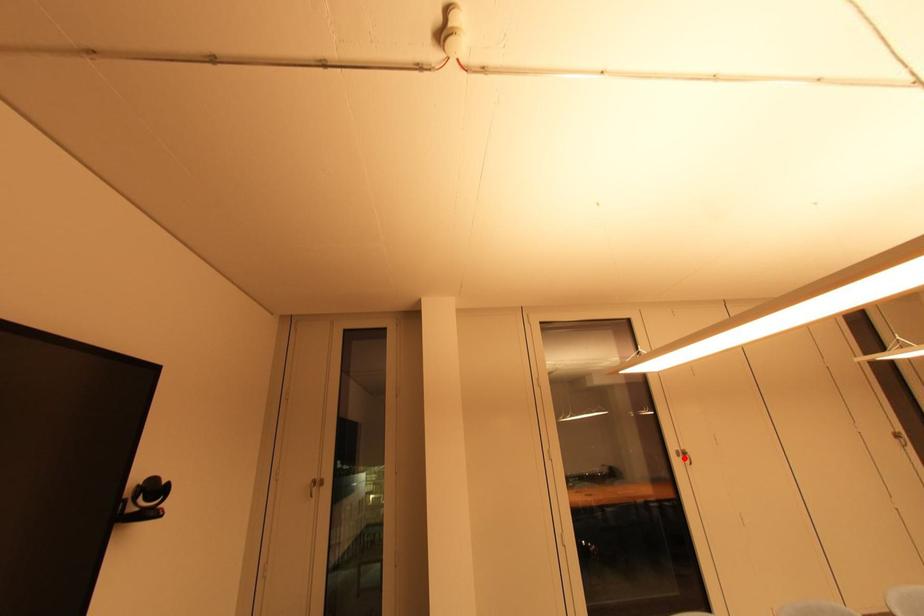
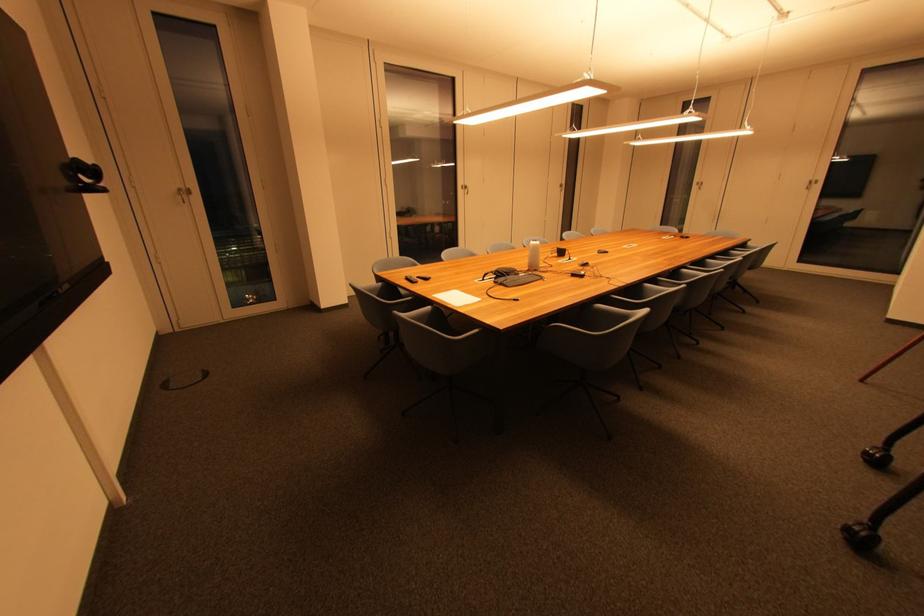
Question: I am providing you with two images of the same scene from different viewpoints. Image1 has a red point marked. In image2, the corresponding 3D location appears at what relative position? Reply with the corresponding letter.

Choices:
 (A) Closer
 (B) Farther

Answer: (A)